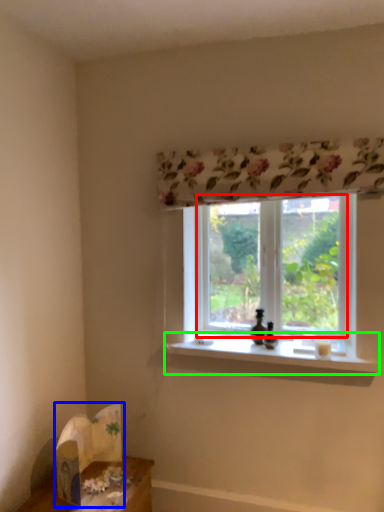
Question: Estimate the real-world distances between objects in this image. Which object is closer to window screen (highlighted by a red box), cardboard box (highlighted by a blue box) or window sill (highlighted by a green box)?

Choices:
 (A) cardboard box
 (B) window sill

Answer: (B)